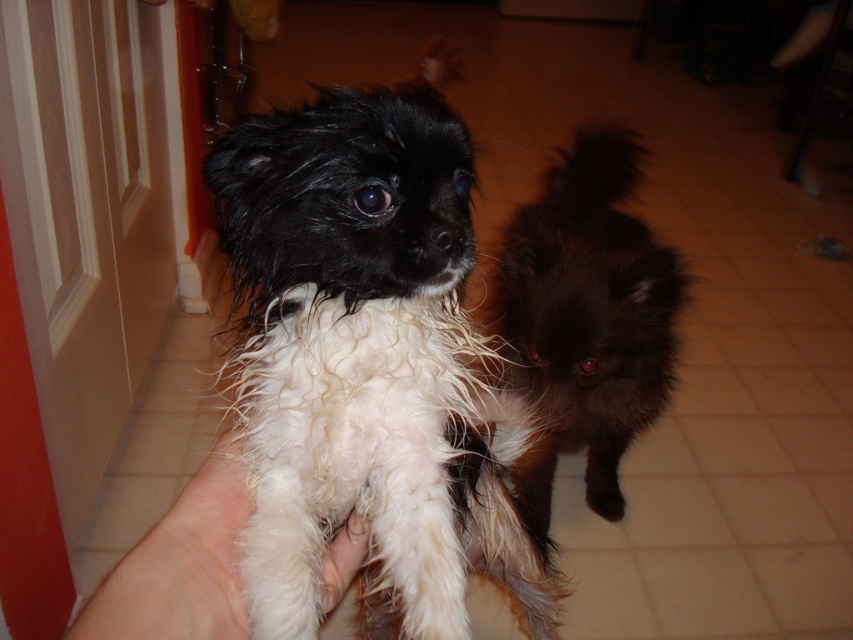
Question: Does white fluffy dog at center have a smaller size compared to white soft hand at center?

Choices:
 (A) no
 (B) yes

Answer: (A)

Question: Is shiny black fur at center to the left of white soft hand at center from the viewer's perspective?

Choices:
 (A) yes
 (B) no

Answer: (B)

Question: Where is white fluffy dog at center located in relation to shiny black fur at center in the image?

Choices:
 (A) right
 (B) left

Answer: (B)

Question: Estimate the real-world distances between objects in this image. Which object is closer to the shiny black fur at center?

Choices:
 (A) white soft hand at center
 (B) white fluffy dog at center

Answer: (B)

Question: Among these objects, which one is nearest to the camera?

Choices:
 (A) white fluffy dog at center
 (B) white soft hand at center

Answer: (B)

Question: Which object appears farthest from the camera in this image?

Choices:
 (A) shiny black fur at center
 (B) white fluffy dog at center
 (C) white soft hand at center

Answer: (A)